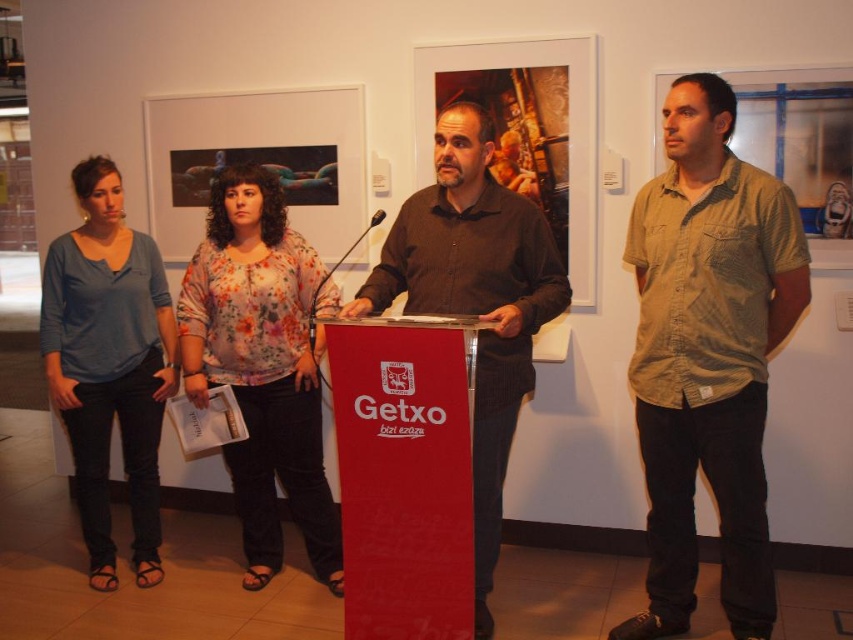
Question: Does floral print blouse at center appear under matte blue shirt at left?

Choices:
 (A) no
 (B) yes

Answer: (B)

Question: Which of the following is the closest to the observer?

Choices:
 (A) (248, 353)
 (B) (697, 106)

Answer: (B)

Question: Which object is farther from the camera taking this photo?

Choices:
 (A) matte blue shirt at left
 (B) floral print blouse at center
 (C) dark brown shirt at center

Answer: (A)

Question: Does khaki cotton shirt at right have a larger size compared to dark brown shirt at center?

Choices:
 (A) yes
 (B) no

Answer: (B)

Question: Is khaki cotton shirt at right bigger than dark brown shirt at center?

Choices:
 (A) no
 (B) yes

Answer: (A)

Question: Which point is farther to the camera?

Choices:
 (A) khaki cotton shirt at right
 (B) dark brown shirt at center

Answer: (A)